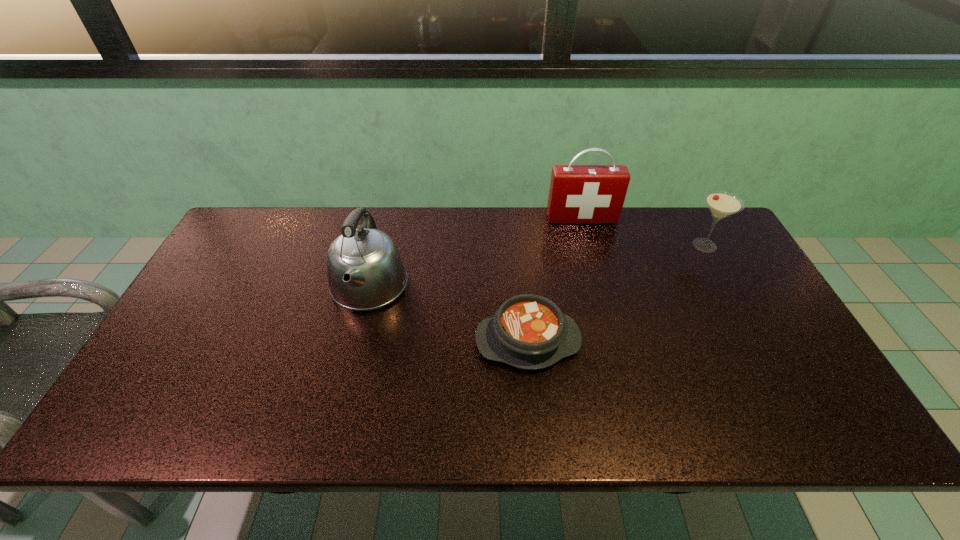
Identify the location of kettle present at the far edge. This screenshot has width=960, height=540. (365, 271).

Find the location of a particular element. Image resolution: width=960 pixels, height=540 pixels. martini that is positioned at the far edge is located at coordinates (721, 204).

Identify the location of object present at the right edge. (721, 204).

In order to click on object located in the far right corner section of the desktop in this screenshot , I will do `click(721, 204)`.

Locate an element on the screen. This screenshot has height=540, width=960. free region at the far edge is located at coordinates (646, 211).

Where is `vacant space at the near edge`? This screenshot has height=540, width=960. vacant space at the near edge is located at coordinates (718, 429).

You are a GUI agent. You are given a task and a screenshot of the screen. Output one action in this format:
    pyautogui.click(x=<x>, y=<y>)
    Task: Click on the vacant space at the right edge of the desktop
    This screenshot has height=540, width=960.
    Given the screenshot: What is the action you would take?
    coord(785,342)

Where is `vacant region at the far right corner of the desktop`? Image resolution: width=960 pixels, height=540 pixels. vacant region at the far right corner of the desktop is located at coordinates (691, 241).

At what (x,y) coordinates should I click in order to perform the action: click on free space between the kettle and the rightmost object. Please return your answer as a coordinate pair (x, y). The width and height of the screenshot is (960, 540). Looking at the image, I should click on (537, 266).

This screenshot has width=960, height=540. I want to click on empty space that is in between the casserole and the first-aid kit, so click(555, 280).